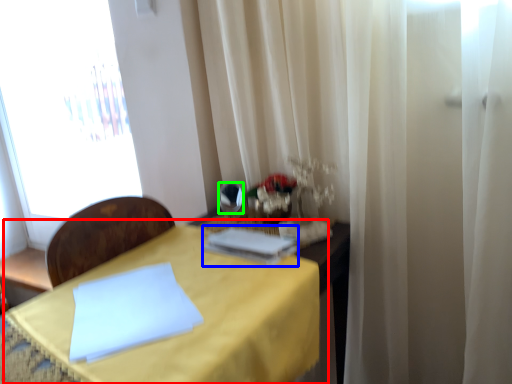
Question: Considering the real-world distances, which object is closest to table (highlighted by a red box)? book (highlighted by a blue box) or mirror (highlighted by a green box).

Choices:
 (A) book
 (B) mirror

Answer: (A)